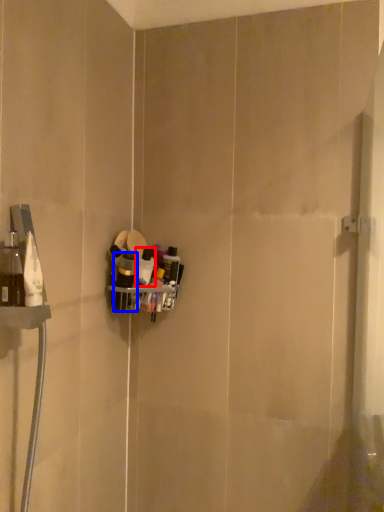
Question: Which object is closer to the camera taking this photo, toiletry (highlighted by a red box) or toiletry (highlighted by a blue box)?

Choices:
 (A) toiletry
 (B) toiletry

Answer: (B)